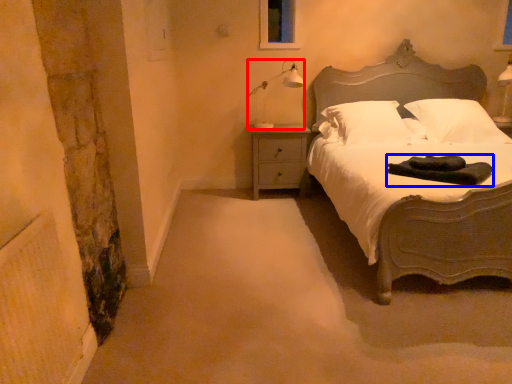
Question: Which object appears farthest to the camera in this image, lamp (highlighted by a red box) or material (highlighted by a blue box)?

Choices:
 (A) lamp
 (B) material

Answer: (A)